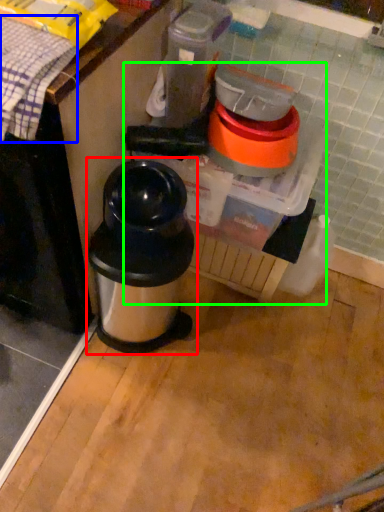
Question: Considering the real-world distances, which object is closest to waste container (highlighted by a red box)? blanket (highlighted by a blue box) or blender (highlighted by a green box).

Choices:
 (A) blanket
 (B) blender

Answer: (B)